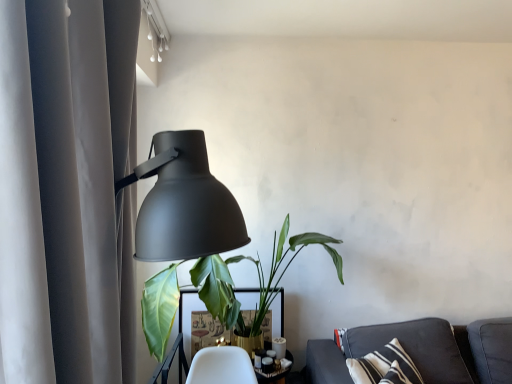
The width and height of the screenshot is (512, 384). What do you see at coordinates (258, 276) in the screenshot?
I see `green leafy plant at center` at bounding box center [258, 276].

At what (x,y) coordinates should I click in order to perform the action: click on green leafy plant at center. Please return your answer as a coordinate pair (x, y). Looking at the image, I should click on (258, 276).

Identify the location of matte gray curtain at left. (67, 190).

Where is `green leafy plant at center`? green leafy plant at center is located at coordinates (258, 276).

From the image's perspective, which is below, white glossy table at center or matte black lamp at left?

From the image's view, white glossy table at center is below.

Considering the relative positions of white glossy table at center and matte black lamp at left in the image provided, is white glossy table at center to the left or to the right of matte black lamp at left?

Clearly, white glossy table at center is on the right of matte black lamp at left in the image.

In terms of width, does white glossy table at center look wider or thinner when compared to matte black lamp at left?

In the image, white glossy table at center appears to be more narrow than matte black lamp at left.

Is green leafy plant at center outside of matte black lamp at left?

Absolutely, green leafy plant at center is external to matte black lamp at left.

Is green leafy plant at center turned away from matte black lamp at left?

No, green leafy plant at center is not facing away from matte black lamp at left.

From the image's perspective, is green leafy plant at center above or below matte black lamp at left?

Based on their image positions, green leafy plant at center is located beneath matte black lamp at left.

Based on their sizes in the image, would you say green leafy plant at center is bigger or smaller than matte black lamp at left?

Clearly, green leafy plant at center is larger in size than matte black lamp at left.

Is matte black lamp at left smaller than white glossy table at center?

Incorrect, matte black lamp at left is not smaller in size than white glossy table at center.

Looking at this image, is the position of matte black lamp at left less distant than that of white glossy table at center?

Yes, the depth of matte black lamp at left is less than that of white glossy table at center.

Where is `table that is under the matte black lamp at left (from a real-world perspective)`? This screenshot has width=512, height=384. table that is under the matte black lamp at left (from a real-world perspective) is located at coordinates (279, 314).

Is matte black lamp at left touching white glossy table at center?

No, matte black lamp at left is not making contact with white glossy table at center.

Is dark gray fabric couch at lower right positioned with its back to white glossy table at center?

Yes.

In the image, is dark gray fabric couch at lower right on the left side or the right side of white glossy table at center?

From the image, it's evident that dark gray fabric couch at lower right is to the right of white glossy table at center.

Is dark gray fabric couch at lower right taller or shorter than white glossy table at center?

Clearly, dark gray fabric couch at lower right is shorter compared to white glossy table at center.

Is green leafy plant at center beside white glossy table at center?

No, green leafy plant at center is not with white glossy table at center.

From a real-world perspective, is green leafy plant at center over white glossy table at center?

Yes, from a real-world perspective, green leafy plant at center is above white glossy table at center.

In terms of size, does green leafy plant at center appear bigger or smaller than white glossy table at center?

In the image, green leafy plant at center appears to be larger than white glossy table at center.

Between green leafy plant at center and white glossy table at center, which one appears on the left side from the viewer's perspective?

white glossy table at center.

Considering the sizes of white glossy table at center and green leafy plant at center in the image, is white glossy table at center wider or thinner than green leafy plant at center?

Clearly, white glossy table at center has less width compared to green leafy plant at center.

Can you confirm if white glossy table at center is bigger than green leafy plant at center?

Actually, white glossy table at center might be smaller than green leafy plant at center.

Based on their positions, is white glossy table at center located to the left or right of green leafy plant at center?

In the image, white glossy table at center appears on the left side of green leafy plant at center.

Does white glossy table at center turn towards green leafy plant at center?

Yes.

Is white glossy table at center situated inside dark gray fabric couch at lower right or outside?

white glossy table at center is outside dark gray fabric couch at lower right.

Which of these two, white glossy table at center or dark gray fabric couch at lower right, stands shorter?

Standing shorter between the two is dark gray fabric couch at lower right.

Between white glossy table at center and dark gray fabric couch at lower right, which one has larger width?

dark gray fabric couch at lower right.

From the image's perspective, would you say white glossy table at center is shown under dark gray fabric couch at lower right?

Actually, white glossy table at center appears above dark gray fabric couch at lower right in the image.

Locate an element on the screen. The width and height of the screenshot is (512, 384). table behind the matte black lamp at left is located at coordinates (279, 314).

The height and width of the screenshot is (384, 512). In order to click on houseplant on the right of matte black lamp at left in this screenshot , I will do `click(258, 276)`.

Estimate the real-world distances between objects in this image. Which object is closer to green leafy plant at center, dark gray fabric couch at lower right or white glossy table at center?

white glossy table at center.

Looking at the image, which one is located further to matte gray curtain at left, matte black lamp at left or white glossy table at center?

Among the two, white glossy table at center is located further to matte gray curtain at left.

Estimate the real-world distances between objects in this image. Which object is further from matte gray curtain at left, matte black lamp at left or green leafy plant at center?

Among the two, green leafy plant at center is located further to matte gray curtain at left.

Consider the image. When comparing their distances from white glossy table at center, does green leafy plant at center or dark gray fabric couch at lower right seem closer?

green leafy plant at center is closer to white glossy table at center.

From the picture: Estimate the real-world distances between objects in this image. Which object is closer to matte gray curtain at left, green leafy plant at center or matte black lamp at left?

matte black lamp at left is closer to matte gray curtain at left.

From the image, which object appears to be farther from matte gray curtain at left, green leafy plant at center or dark gray fabric couch at lower right?

Among the two, dark gray fabric couch at lower right is located further to matte gray curtain at left.

When comparing their distances from green leafy plant at center, does white glossy table at center or dark gray fabric couch at lower right seem closer?

white glossy table at center.

From the image, which object appears to be farther from white glossy table at center, matte gray curtain at left or green leafy plant at center?

Based on the image, matte gray curtain at left appears to be further to white glossy table at center.

What are the coordinates of `houseplant between matte gray curtain at left and white glossy table at center from front to back` in the screenshot? It's located at (258, 276).

At what (x,y) coordinates should I click in order to perform the action: click on lamp positioned between matte gray curtain at left and white glossy table at center from near to far. Please return your answer as a coordinate pair (x, y). This screenshot has width=512, height=384. Looking at the image, I should click on (183, 230).

This screenshot has height=384, width=512. In order to click on studio couch between matte gray curtain at left and white glossy table at center from front to back in this screenshot , I will do `click(422, 351)`.

You are a GUI agent. You are given a task and a screenshot of the screen. Output one action in this format:
    pyautogui.click(x=<x>, y=<y>)
    Task: Click on the lamp between matte gray curtain at left and dark gray fabric couch at lower right in the horizontal direction
    The image size is (512, 384).
    Given the screenshot: What is the action you would take?
    pyautogui.click(x=183, y=230)